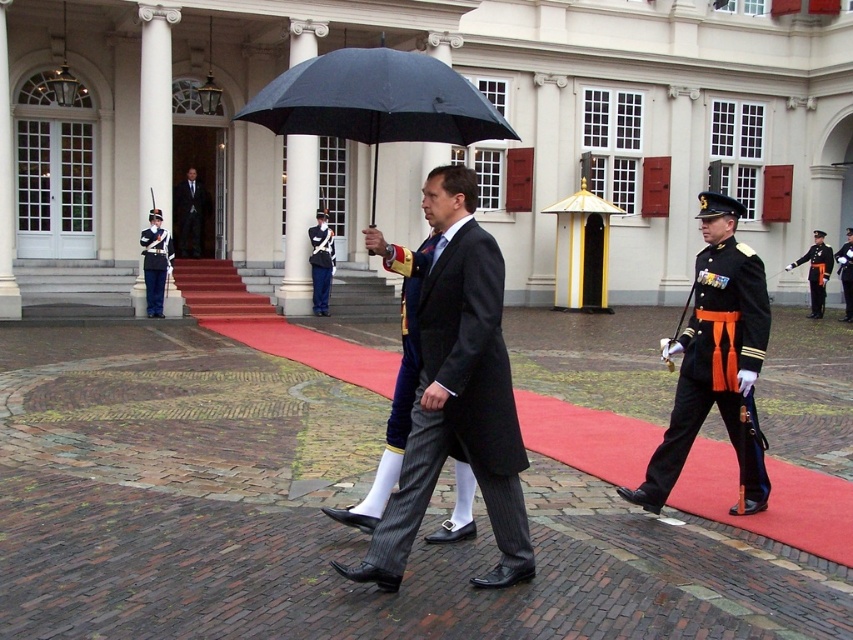
What are the coordinates of the black matte umbrella at center?

The coordinates of the black matte umbrella at center are 0.159 in the x axis and 0.442 in the y axis.

You are a photographer positioned at the entrance of the building. You want to take a photo that captures both the black matte umbrella at center and the black suit at center. Which object will appear larger in the photo?

The black matte umbrella at center will appear larger in the photo because it is closer to the viewer than the black suit at center.